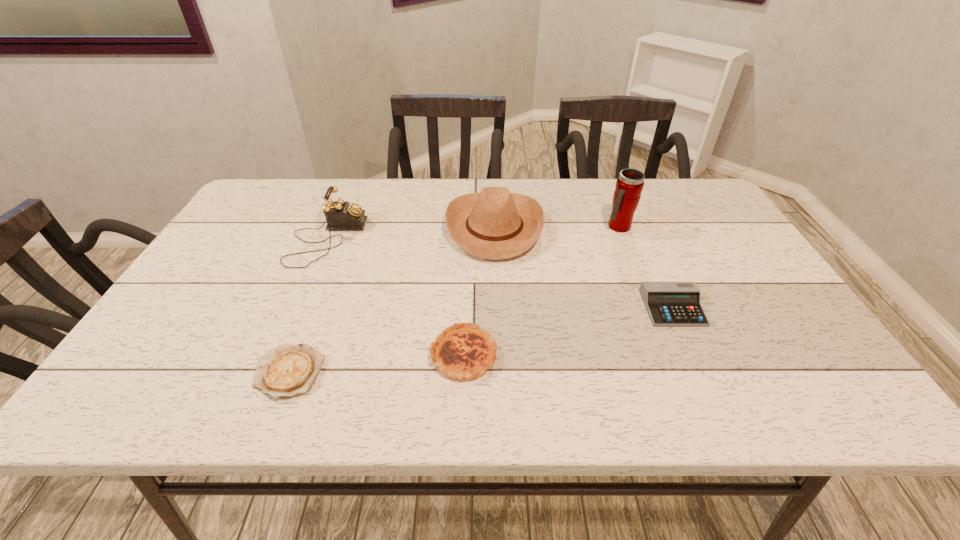
Where is `free space between the left quiche and the right quiche`? This screenshot has height=540, width=960. free space between the left quiche and the right quiche is located at coordinates 376,363.

Where is `free point between the telephone and the taller quiche`? free point between the telephone and the taller quiche is located at coordinates (396, 297).

Where is `vacant area between the shortest object and the right quiche`? Image resolution: width=960 pixels, height=540 pixels. vacant area between the shortest object and the right quiche is located at coordinates (376, 363).

Where is `vacant space that is in between the telephone and the taller quiche`? vacant space that is in between the telephone and the taller quiche is located at coordinates (396, 297).

This screenshot has height=540, width=960. Identify the location of object that ranks as the fifth closest to the thermos bottle. (288, 370).

Where is `object identified as the closest to the shorter quiche`? The image size is (960, 540). object identified as the closest to the shorter quiche is located at coordinates (463, 351).

Find the location of a particular element. The image size is (960, 540). vacant area that satisfies the following two spatial constraints: 1. on the dial of the taller quiche; 2. on the right side of the telephone is located at coordinates (277, 355).

The height and width of the screenshot is (540, 960). I want to click on free space that satisfies the following two spatial constraints: 1. on the side with the handle of the thermos bottle; 2. on the dial of the telephone, so click(623, 239).

Find the location of a particular element. This screenshot has height=540, width=960. vacant area in the image that satisfies the following two spatial constraints: 1. on the front-facing side of the calculator; 2. on the right side of the cowboy hat is located at coordinates (498, 308).

At what (x,y) coordinates should I click in order to perform the action: click on free spot that satisfies the following two spatial constraints: 1. on the dial of the telephone; 2. on the left side of the fourth farthest object. Please return your answer as a coordinate pair (x, y). This screenshot has width=960, height=540. Looking at the image, I should click on (298, 308).